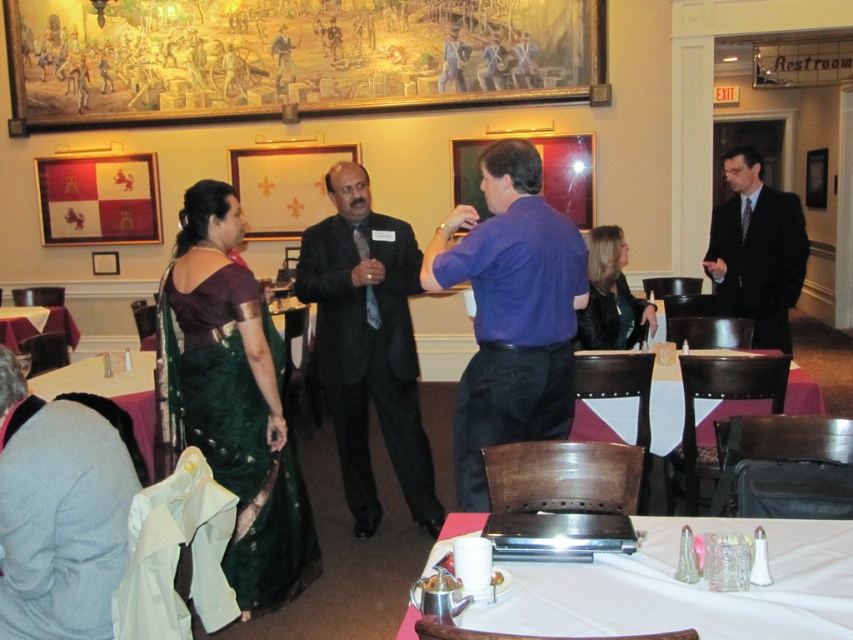
Is purple cotton shirt at center to the right of white glossy table at lower left from the viewer's perspective?

Yes, purple cotton shirt at center is to the right of white glossy table at lower left.

Describe the element at coordinates (511, 312) in the screenshot. The image size is (853, 640). I see `purple cotton shirt at center` at that location.

Who is more forward, (x=439, y=230) or (x=12, y=326)?

Point (x=439, y=230)

Locate an element on the screen. This screenshot has height=640, width=853. purple cotton shirt at center is located at coordinates (511, 312).

Can you confirm if black suit at right is positioned above white leather table at center?

Yes, black suit at right is above white leather table at center.

Is point (804, 262) more distant than point (680, 435)?

Yes, point (804, 262) is farther from viewer.

Is point (753, 339) less distant than point (795, 364)?

Yes, point (753, 339) is closer to viewer.

The image size is (853, 640). Find the location of `black suit at right`. black suit at right is located at coordinates (756, 250).

Does metallic silver laptop at center appear on the left side of white leather table at center?

Yes, metallic silver laptop at center is to the left of white leather table at center.

Between metallic silver laptop at center and white leather table at center, which one is positioned lower?

metallic silver laptop at center is below.

This screenshot has height=640, width=853. In order to click on metallic silver laptop at center in this screenshot , I will do `click(683, 588)`.

The width and height of the screenshot is (853, 640). What are the coordinates of `metallic silver laptop at center` in the screenshot? It's located at (683, 588).